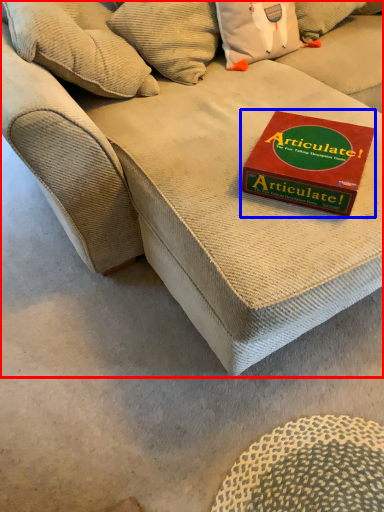
Question: Which point is further to the camera, studio couch (highlighted by a red box) or paperback book (highlighted by a blue box)?

Choices:
 (A) studio couch
 (B) paperback book

Answer: (B)